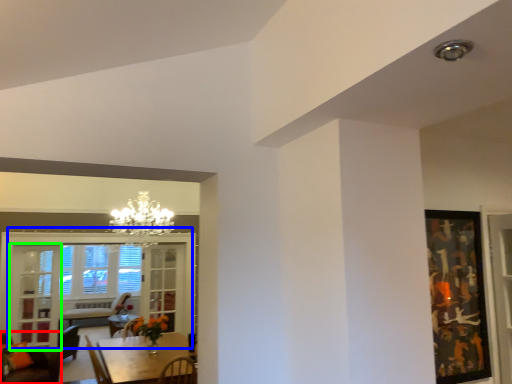
Question: Which object is positioned closest to chair (highlighted by a red box)? Select from window (highlighted by a blue box) and glass door (highlighted by a green box).

Choices:
 (A) window
 (B) glass door

Answer: (B)